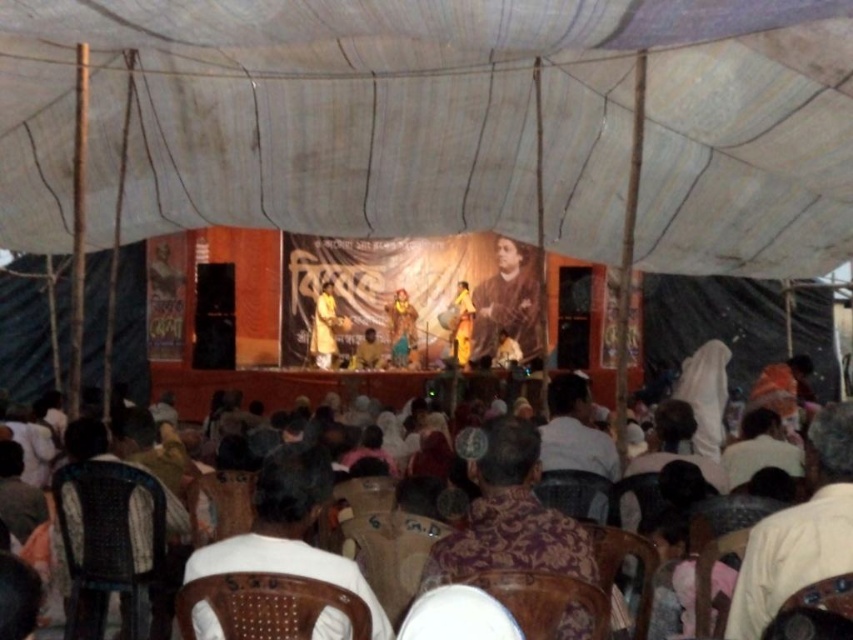
You are an event photographer positioned at the front of the tent. You want to capture a clear shot of the brown fabric cloth at center without the yellow fabric at center blocking it. What should you do?

The yellow fabric at center is in front of the brown fabric cloth at center, so you should move your position to the side or adjust your angle to avoid the obstruction caused by the yellow fabric at center.

You are standing inside the tent and want to move from the point closer to you to the point further away. Which path would you take to go from the point at coordinates point (309,353) to the point at coordinates point (376,342)?

The point at coordinates point (309,353) is closer to the viewer than the point at coordinates point (376,342). To move from the closer point to the further one, you would need to walk away from the stage towards the entrance of the tent.

You are an event photographer at the front of the stage. You need to take a photo of both the golden fabric sari at center and the brown fabric cloth at center. Which one should you adjust your camera focus to first if you want to capture both in one shot?

The golden fabric sari at center is to the left of brown fabric cloth at center. Since they are both at center, you can focus on either one first as they are positioned closely together.